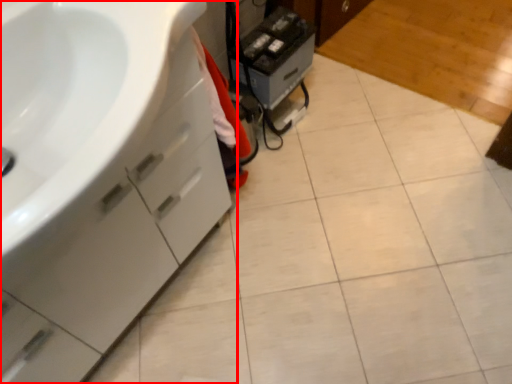
Question: From the image's perspective, what is the correct spatial positioning of bathroom cabinet (annotated by the red box) in reference to appliance?

Choices:
 (A) below
 (B) above

Answer: (A)